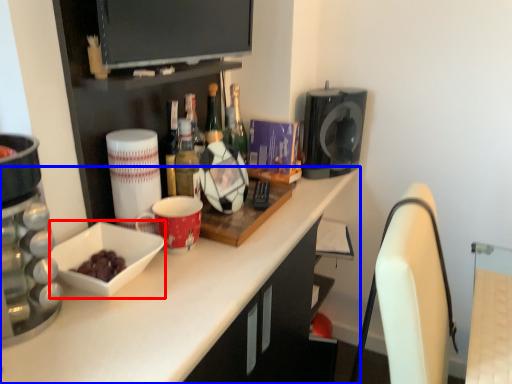
Question: Which of the following is the farthest to the observer, bowl (highlighted by a red box) or countertop (highlighted by a blue box)?

Choices:
 (A) bowl
 (B) countertop

Answer: (A)